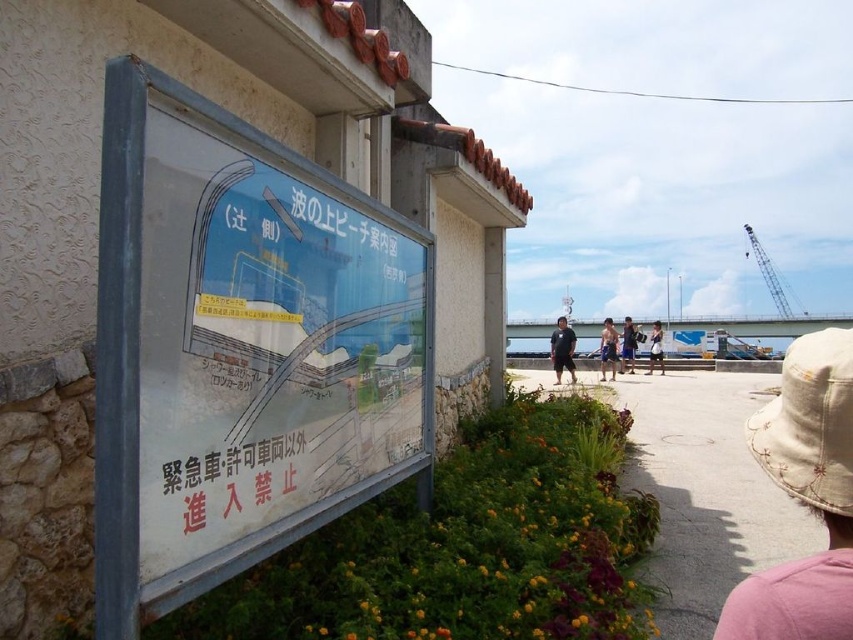
You are a tourist at the coastal area and want to know which item is taller between the beige fabric hat at lower right and the blue fabric shorts at center. Can you tell me?

The beige fabric hat at lower right is taller than blue fabric shorts at center.

You are standing in front of the signboard at the coastal area. There are two points marked on the route diagram on the signboard. The first point is at coordinate point (614,369) and the second is at point (630,371). From your perspective, which point is closer to you?

Point (614,369) is in front of point (630,371), so the first point is closer to you.

You are standing in front of a coastal signboard and notice a white plastic sign at center and a matte black shirt at center. Which object is nearer to you?

The white plastic sign at center is closer to the viewer than the matte black shirt at center.